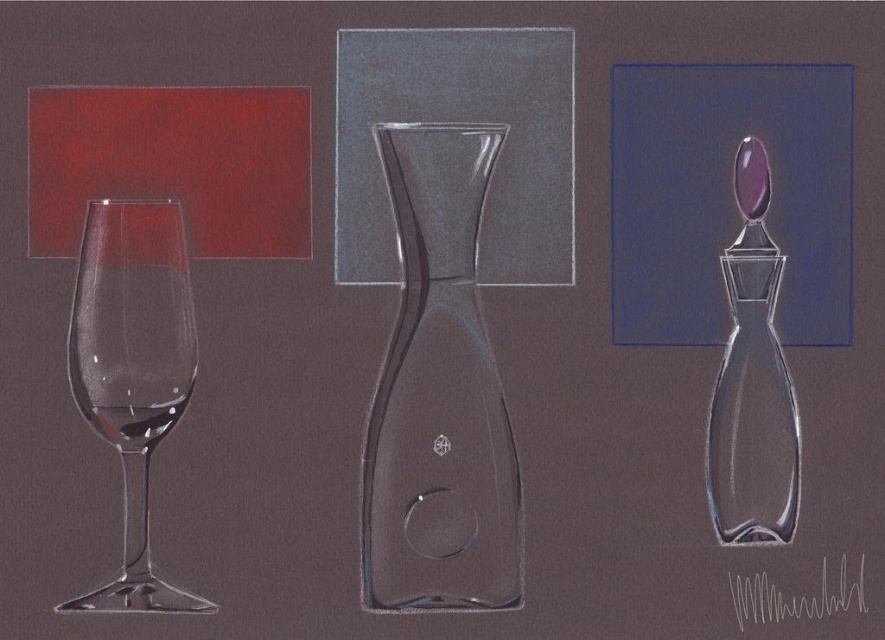
You are an interior designer arranging these objects on a shelf. You need to place the transparent glass bottle at right and the transparent glass wine at left such that the wider object is on the left. Is the current arrangement correct?

The transparent glass bottle at right has a lesser width compared to transparent glass wine at left, so the current arrangement already places the wider transparent glass wine at left on the left, which meets the requirement.

You are an interior designer arranging these items on a shelf. The shelf has limited space, and you need to know the spatial relationship between the transparent glass carafe at center and the transparent glass wine glass at left. Which one is placed in front of the other?

The transparent glass carafe at center is positioned over transparent glass wine glass at left, meaning the carafe is in front of the wine glass.